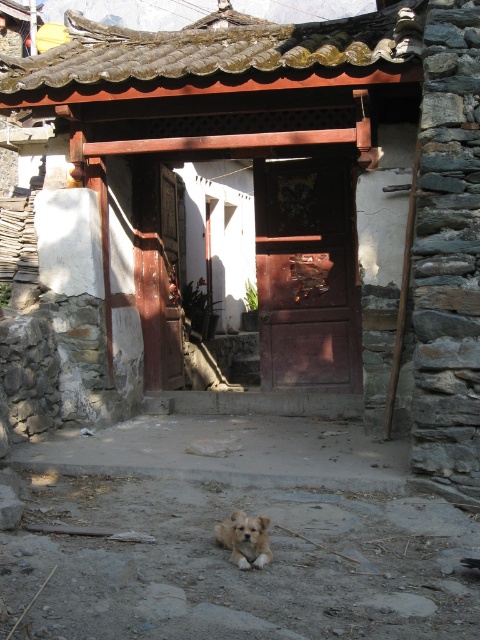
You are a delivery person holding a package and standing in front of the dark wood door at center. The light brown fur dog at center is blocking your path to the door. Can you step around the dog without moving it?

The dark wood door at center is much taller than the light brown fur dog at center, so you can step around the dog on either side since the door is taller and provides enough vertical space to navigate around the dog without needing to move it.

You are standing in front of the rustic doorway. The wooden door at center is your only way to enter the building. If you are 6 feet tall, can you reach the doorknob which is at the same height as the top of your head?

The wooden door at center and viewer are 28.53 feet apart from each other. Since the doorknob is at the same height as your head, you can reach it as distance does not affect height reachability.

You are standing in front of the rustic doorway. There is a point marked at coordinates (227, 157). Which object does this point correspond to?

The point at coordinates (227, 157) corresponds to the wooden door at center.